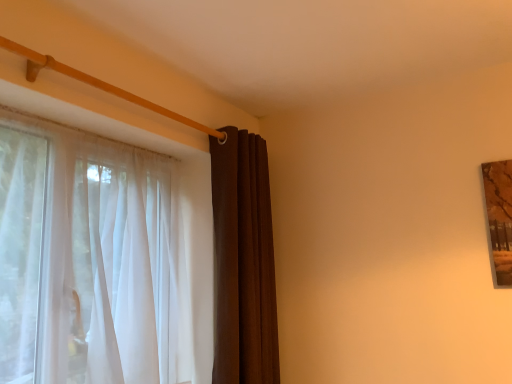
In order to face sheer white curtain at left, which is the first curtain in left-to-right order, should I rotate leftwards or rightwards?

Turn left by 19.209 degrees to look at sheer white curtain at left, which is the first curtain in left-to-right order.

This screenshot has height=384, width=512. What do you see at coordinates (122, 262) in the screenshot?
I see `sheer white curtain at left, which ranks as the second curtain in right-to-left order` at bounding box center [122, 262].

Find the location of a particular element. Image resolution: width=512 pixels, height=384 pixels. sheer white curtain at left, which is the first curtain in left-to-right order is located at coordinates (122, 262).

The image size is (512, 384). What do you see at coordinates (243, 262) in the screenshot?
I see `brown velvet curtain at center, the first curtain when ordered from right to left` at bounding box center [243, 262].

Where is `brown velvet curtain at center, acting as the second curtain starting from the left`? The width and height of the screenshot is (512, 384). brown velvet curtain at center, acting as the second curtain starting from the left is located at coordinates (243, 262).

Identify the location of sheer white curtain at left, which ranks as the second curtain in right-to-left order. The width and height of the screenshot is (512, 384). (122, 262).

Can you confirm if sheer white curtain at left, which ranks as the second curtain in right-to-left order, is positioned to the right of brown velvet curtain at center, the first curtain when ordered from right to left?

No, sheer white curtain at left, which ranks as the second curtain in right-to-left order, is not to the right of brown velvet curtain at center, the first curtain when ordered from right to left.

Relative to brown velvet curtain at center, acting as the second curtain starting from the left, is sheer white curtain at left, which ranks as the second curtain in right-to-left order, in front or behind?

Visually, sheer white curtain at left, which ranks as the second curtain in right-to-left order, is located in front of brown velvet curtain at center, acting as the second curtain starting from the left.

Is point (182, 331) closer or farther from the camera than point (262, 358)?

Point (182, 331) is farther from the camera than point (262, 358).

From the image's perspective, relative to brown velvet curtain at center, acting as the second curtain starting from the left, is sheer white curtain at left, which ranks as the second curtain in right-to-left order, above or below?

sheer white curtain at left, which ranks as the second curtain in right-to-left order, is situated higher than brown velvet curtain at center, acting as the second curtain starting from the left, in the image.

From a real-world perspective, is sheer white curtain at left, which is the first curtain in left-to-right order, physically located above or below brown velvet curtain at center, acting as the second curtain starting from the left?

In terms of real-world spatial position, sheer white curtain at left, which is the first curtain in left-to-right order, is below brown velvet curtain at center, acting as the second curtain starting from the left.

Between sheer white curtain at left, which ranks as the second curtain in right-to-left order, and brown velvet curtain at center, acting as the second curtain starting from the left, which one has smaller width?

Thinner between the two is brown velvet curtain at center, acting as the second curtain starting from the left.

Considering the relative sizes of sheer white curtain at left, which is the first curtain in left-to-right order, and brown velvet curtain at center, acting as the second curtain starting from the left, in the image provided, is sheer white curtain at left, which is the first curtain in left-to-right order, shorter than brown velvet curtain at center, acting as the second curtain starting from the left,?

Yes.

Considering the sizes of objects sheer white curtain at left, which is the first curtain in left-to-right order, and brown velvet curtain at center, acting as the second curtain starting from the left, in the image provided, who is smaller, sheer white curtain at left, which is the first curtain in left-to-right order, or brown velvet curtain at center, acting as the second curtain starting from the left,?

brown velvet curtain at center, acting as the second curtain starting from the left, is smaller.

Is brown velvet curtain at center, the first curtain when ordered from right to left, located within sheer white curtain at left, which ranks as the second curtain in right-to-left order?

No, brown velvet curtain at center, the first curtain when ordered from right to left, is not inside sheer white curtain at left, which ranks as the second curtain in right-to-left order.

Would you consider sheer white curtain at left, which ranks as the second curtain in right-to-left order, to be distant from brown velvet curtain at center, the first curtain when ordered from right to left?

sheer white curtain at left, which ranks as the second curtain in right-to-left order, is near brown velvet curtain at center, the first curtain when ordered from right to left, not far away.

Is sheer white curtain at left, which ranks as the second curtain in right-to-left order, turned away from brown velvet curtain at center, the first curtain when ordered from right to left?

sheer white curtain at left, which ranks as the second curtain in right-to-left order, is not turned away from brown velvet curtain at center, the first curtain when ordered from right to left.

What's the angular difference between sheer white curtain at left, which is the first curtain in left-to-right order, and brown velvet curtain at center, the first curtain when ordered from right to left,'s facing directions?

0.358 degrees separate the facing orientations of sheer white curtain at left, which is the first curtain in left-to-right order, and brown velvet curtain at center, the first curtain when ordered from right to left.

Identify the location of curtain above the brown velvet curtain at center, acting as the second curtain starting from the left (from the image's perspective). This screenshot has width=512, height=384. (122, 262).

Is brown velvet curtain at center, the first curtain when ordered from right to left, to the left of sheer white curtain at left, which ranks as the second curtain in right-to-left order, from the viewer's perspective?

No.

Does brown velvet curtain at center, acting as the second curtain starting from the left, come behind sheer white curtain at left, which is the first curtain in left-to-right order?

Yes, the depth of brown velvet curtain at center, acting as the second curtain starting from the left, is greater than that of sheer white curtain at left, which is the first curtain in left-to-right order.

Does point (219, 297) lie in front of point (117, 205)?

No, it is not.

From the image's perspective, is brown velvet curtain at center, acting as the second curtain starting from the left, positioned above or below sheer white curtain at left, which is the first curtain in left-to-right order?

Clearly, from the image's perspective, brown velvet curtain at center, acting as the second curtain starting from the left, is below sheer white curtain at left, which is the first curtain in left-to-right order.

From a real-world perspective, is brown velvet curtain at center, acting as the second curtain starting from the left, on sheer white curtain at left, which is the first curtain in left-to-right order?

Yes.

Which of these two, brown velvet curtain at center, acting as the second curtain starting from the left, or sheer white curtain at left, which is the first curtain in left-to-right order, is thinner?

With smaller width is brown velvet curtain at center, acting as the second curtain starting from the left.

Is brown velvet curtain at center, acting as the second curtain starting from the left, taller or shorter than sheer white curtain at left, which ranks as the second curtain in right-to-left order?

Clearly, brown velvet curtain at center, acting as the second curtain starting from the left, is taller compared to sheer white curtain at left, which ranks as the second curtain in right-to-left order.

Who is bigger, brown velvet curtain at center, acting as the second curtain starting from the left, or sheer white curtain at left, which ranks as the second curtain in right-to-left order?

With larger size is sheer white curtain at left, which ranks as the second curtain in right-to-left order.

Is brown velvet curtain at center, acting as the second curtain starting from the left, positioned beyond the bounds of sheer white curtain at left, which is the first curtain in left-to-right order?

brown velvet curtain at center, acting as the second curtain starting from the left, lies outside sheer white curtain at left, which is the first curtain in left-to-right order,'s area.

Are brown velvet curtain at center, acting as the second curtain starting from the left, and sheer white curtain at left, which is the first curtain in left-to-right order, beside each other?

No, brown velvet curtain at center, acting as the second curtain starting from the left, is not next to sheer white curtain at left, which is the first curtain in left-to-right order.

Consider the image. Could you tell me if brown velvet curtain at center, the first curtain when ordered from right to left, is facing sheer white curtain at left, which ranks as the second curtain in right-to-left order?

No.

Measure the distance between brown velvet curtain at center, acting as the second curtain starting from the left, and sheer white curtain at left, which is the first curtain in left-to-right order.

brown velvet curtain at center, acting as the second curtain starting from the left, is 29.88 centimeters away from sheer white curtain at left, which is the first curtain in left-to-right order.

Where is `curtain above the sheer white curtain at left, which is the first curtain in left-to-right order (from a real-world perspective)`? The height and width of the screenshot is (384, 512). curtain above the sheer white curtain at left, which is the first curtain in left-to-right order (from a real-world perspective) is located at coordinates (243, 262).

Locate an element on the screen. curtain beneath the brown velvet curtain at center, the first curtain when ordered from right to left (from a real-world perspective) is located at coordinates (122, 262).

Identify the location of curtain below the sheer white curtain at left, which ranks as the second curtain in right-to-left order (from the image's perspective). (243, 262).